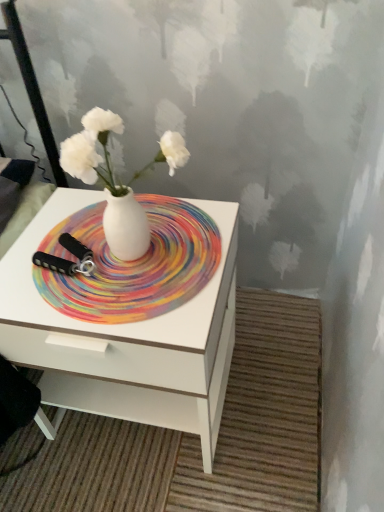
Where is `vacant space situated above rainbow swirl placemat at center (from a real-world perspective)`? This screenshot has width=384, height=512. vacant space situated above rainbow swirl placemat at center (from a real-world perspective) is located at coordinates (125, 253).